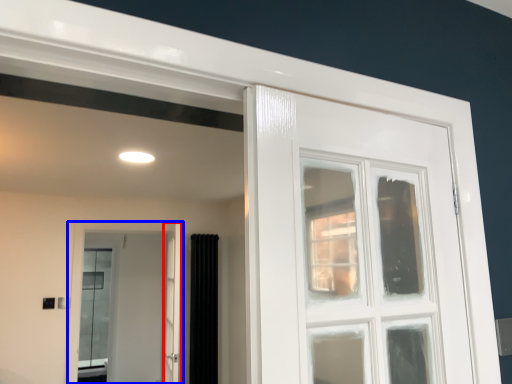
Question: Which point is closer to the camera, screen door (highlighted by a red box) or door (highlighted by a blue box)?

Choices:
 (A) screen door
 (B) door

Answer: (A)